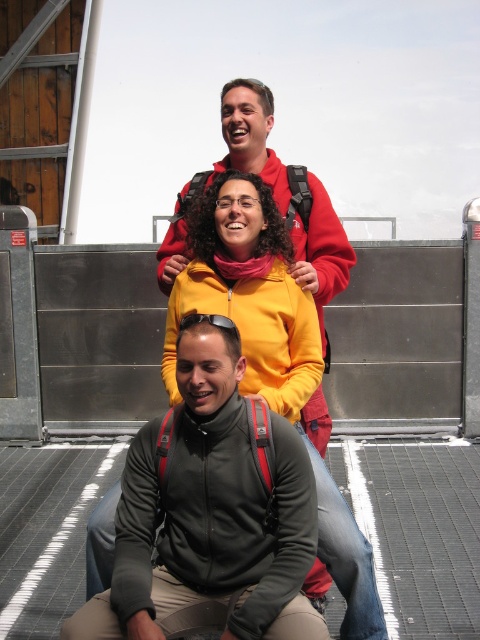
Is point (240, 296) in front of point (226, 164)?

Yes, point (240, 296) is in front of point (226, 164).

Which is below, yellow matte jacket at center or matte red jacket at upper center?

yellow matte jacket at center

Locate an element on the screen. This screenshot has height=640, width=480. yellow matte jacket at center is located at coordinates (271, 355).

The image size is (480, 640). In order to click on yellow matte jacket at center in this screenshot , I will do `click(271, 355)`.